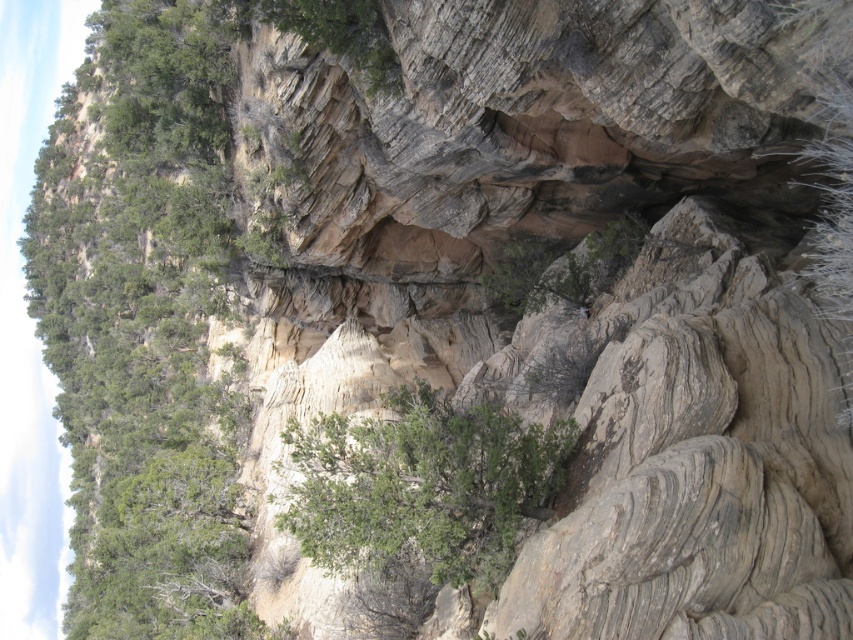
You are standing at the base of the rocky cliff and see the point marked as point (144, 323). What does this point represent?

The point (144, 323) represents the location of the green leafy tree at upper left.